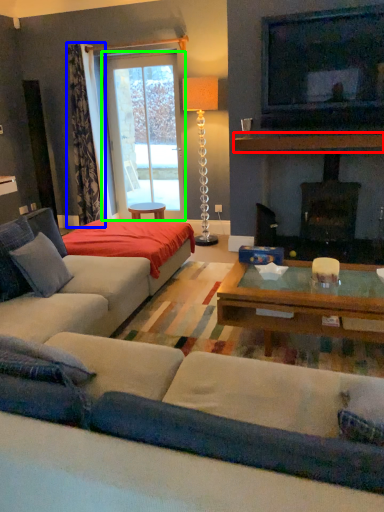
Question: Based on their relative distances, which object is farther from mantle (highlighted by a red box)? Choose from curtain (highlighted by a blue box) and window screen (highlighted by a green box).

Choices:
 (A) curtain
 (B) window screen

Answer: (A)